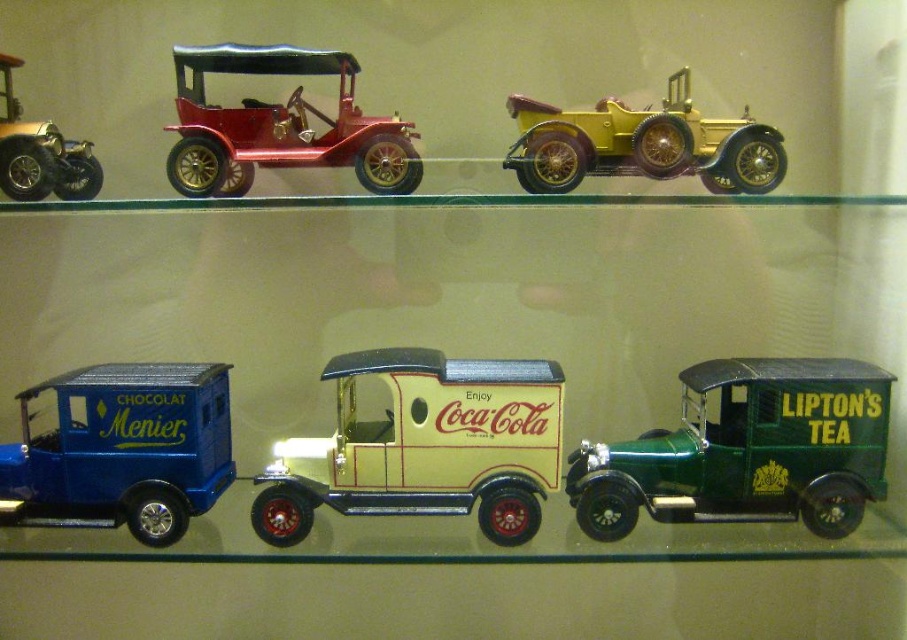
You are a museum curator planning to place a new toy truck between the green matte van at lower right and the metallic blue van at lower left. Based on their sizes, which van should the truck be placed closer to for stability?

The green matte van at lower right is larger in size than the metallic blue van at lower left, so placing the truck closer to the green matte van at lower right would provide better stability due to its larger base.